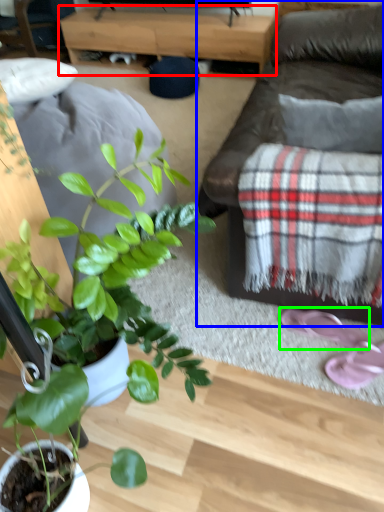
Question: Based on their relative distances, which object is farther from table (highlighted by a red box)? Choose from studio couch (highlighted by a blue box) and footwear (highlighted by a green box).

Choices:
 (A) studio couch
 (B) footwear

Answer: (B)